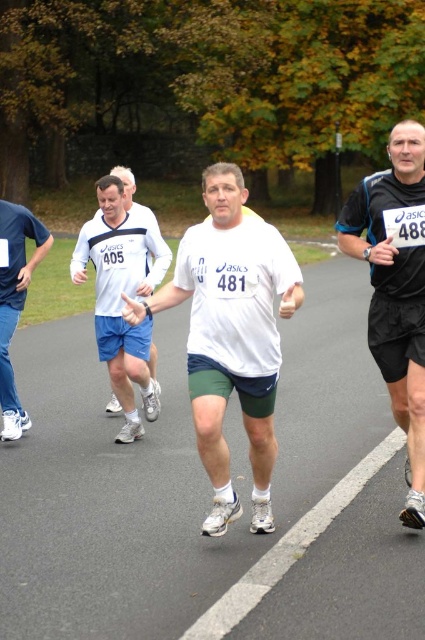
Question: Does white matte t-shirt at center appear on the right side of blue fabric shirt at left?

Choices:
 (A) yes
 (B) no

Answer: (A)

Question: Can you confirm if black matte running shirt at right is smaller than blue fabric shirt at left?

Choices:
 (A) yes
 (B) no

Answer: (B)

Question: Which point is closer to the camera taking this photo?

Choices:
 (A) (229, 364)
 (B) (413, 289)
 (C) (11, 301)

Answer: (A)

Question: Does white matte t-shirt at center have a greater width compared to white matte shirt at center?

Choices:
 (A) yes
 (B) no

Answer: (B)

Question: Which is nearer to the blue fabric shirt at left?

Choices:
 (A) white matte shirt at center
 (B) black matte running shirt at right

Answer: (A)

Question: Which object appears closest to the camera in this image?

Choices:
 (A) white matte shirt at center
 (B) white matte t-shirt at center
 (C) black matte running shirt at right
 (D) blue fabric shirt at left

Answer: (B)